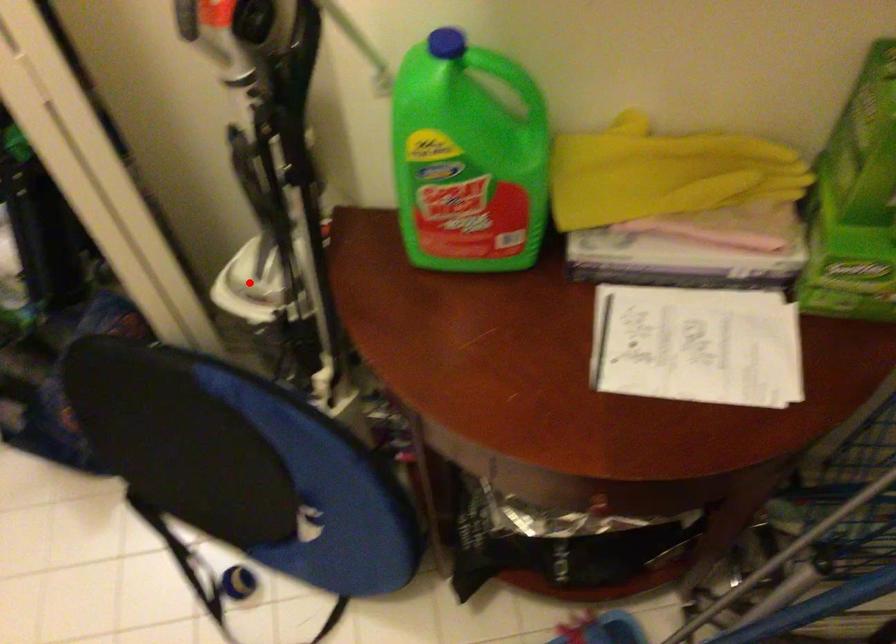
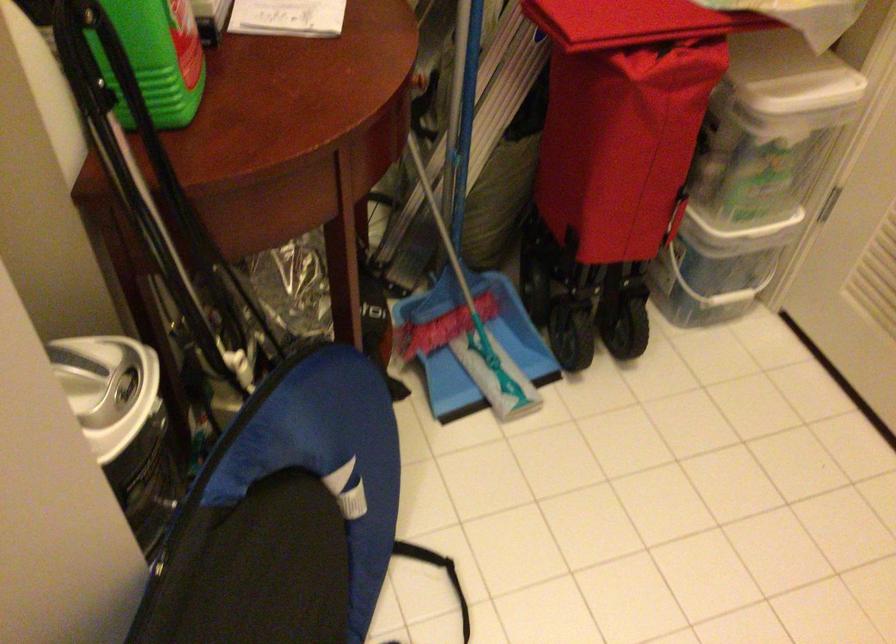
Question: I am providing you with two images of the same scene from different viewpoints. A red point is shown in image1. For the corresponding object point in image2, is it positioned nearer or farther from the camera?

Choices:
 (A) Nearer
 (B) Farther

Answer: (A)